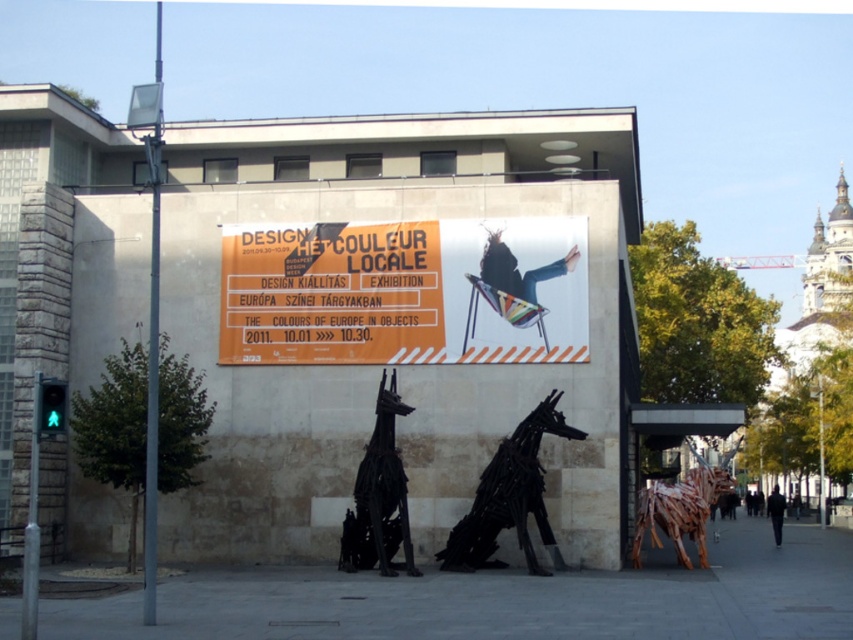
You are standing at the camera position looking at the urban street scene. There is a point marked at coordinates point (363, 246). Can you walk to that point from your current position?

The point (363, 246) is 96.20 feet away from the camera, so yes, you can walk to that point from your current position as it is within a reachable distance.

You are a delivery person who needs to place a small package exactly at the center of the black wire dog at center. The coordinate system of the scene is defined with the bottom left corner as the origin. What are the coordinates where you should place the package?

The coordinates for the black wire dog at center are at point (509, 497), so you should place the package at those coordinates.